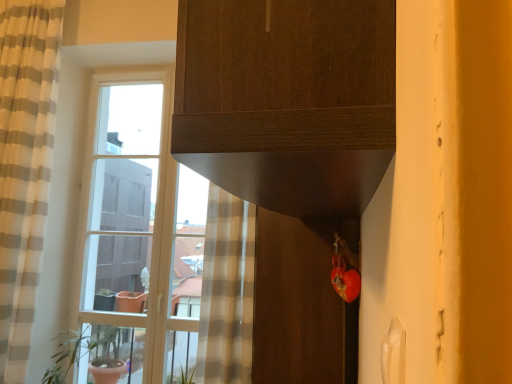
Question: Is green matte plant pot at left in front of or behind beige striped curtain at left in the image?

Choices:
 (A) front
 (B) behind

Answer: (B)

Question: Does point (67, 342) appear closer or farther from the camera than point (50, 69)?

Choices:
 (A) farther
 (B) closer

Answer: (A)

Question: Estimate the real-world distances between objects in this image. Which object is farther from the beige striped curtain at left?

Choices:
 (A) matte brown screen door at lower center
 (B) green matte plant pot at left
 (C) clear glass window at left

Answer: (A)

Question: Based on their relative distances, which object is farther from the clear glass window at left?

Choices:
 (A) beige striped curtain at left
 (B) matte brown screen door at lower center
 (C) green matte plant pot at left

Answer: (B)